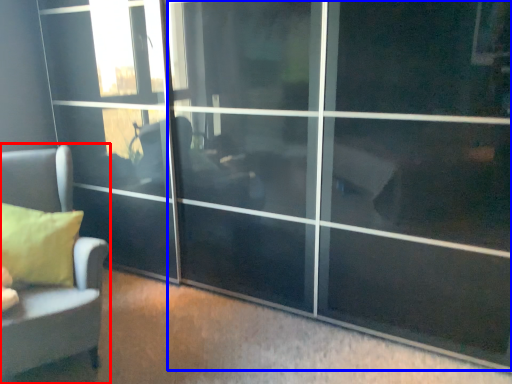
Question: Which point is further to the camera, furniture (highlighted by a red box) or screen door (highlighted by a blue box)?

Choices:
 (A) furniture
 (B) screen door

Answer: (A)